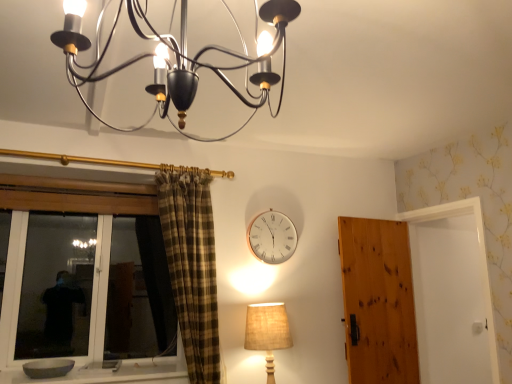
Question: Considering the relative sizes of gray stone bowl at lower left and metallic chandelier at upper center, the 1th lamp from the top, in the image provided, is gray stone bowl at lower left bigger than metallic chandelier at upper center, the 1th lamp from the top,?

Choices:
 (A) yes
 (B) no

Answer: (B)

Question: Is gray stone bowl at lower left not near metallic chandelier at upper center, positioned as the second lamp in back-to-front order?

Choices:
 (A) no
 (B) yes

Answer: (B)

Question: Is gray stone bowl at lower left turned away from metallic chandelier at upper center, positioned as the second lamp in back-to-front order?

Choices:
 (A) no
 (B) yes

Answer: (A)

Question: From the image's perspective, does gray stone bowl at lower left appear lower than metallic chandelier at upper center, which is counted as the 1th lamp, starting from the front?

Choices:
 (A) yes
 (B) no

Answer: (A)

Question: Is gray stone bowl at lower left positioned before metallic chandelier at upper center, positioned as the second lamp in back-to-front order?

Choices:
 (A) no
 (B) yes

Answer: (A)

Question: In the image, is burlap beige lampshade at lower right, acting as the 1th lamp starting from the back, positioned in front of or behind gray stone bowl at lower left?

Choices:
 (A) behind
 (B) front

Answer: (A)

Question: Considering the positions of burlap beige lampshade at lower right, the first lamp from the bottom, and gray stone bowl at lower left in the image, is burlap beige lampshade at lower right, the first lamp from the bottom, wider or thinner than gray stone bowl at lower left?

Choices:
 (A) wide
 (B) thin

Answer: (B)

Question: From a real-world perspective, is burlap beige lampshade at lower right, the first lamp from the bottom, physically located above or below gray stone bowl at lower left?

Choices:
 (A) below
 (B) above

Answer: (B)

Question: Which is correct: burlap beige lampshade at lower right, which ranks as the 2th lamp in front-to-back order, is inside gray stone bowl at lower left, or outside of it?

Choices:
 (A) outside
 (B) inside

Answer: (A)

Question: In the image, is white metallic clock at upper center positioned in front of or behind gray stone bowl at lower left?

Choices:
 (A) front
 (B) behind

Answer: (B)

Question: Considering the relative positions of white metallic clock at upper center and gray stone bowl at lower left in the image provided, is white metallic clock at upper center to the left or to the right of gray stone bowl at lower left?

Choices:
 (A) left
 (B) right

Answer: (B)

Question: From a real-world perspective, is white metallic clock at upper center positioned above or below gray stone bowl at lower left?

Choices:
 (A) below
 (B) above

Answer: (B)

Question: From the image's perspective, is white metallic clock at upper center located above or below gray stone bowl at lower left?

Choices:
 (A) above
 (B) below

Answer: (A)

Question: In terms of size, does wooden door at right appear bigger or smaller than metallic chandelier at upper center, the 1th lamp from the top?

Choices:
 (A) big
 (B) small

Answer: (A)

Question: Is wooden door at right in front of or behind metallic chandelier at upper center, which is counted as the 1th lamp, starting from the front, in the image?

Choices:
 (A) behind
 (B) front

Answer: (A)